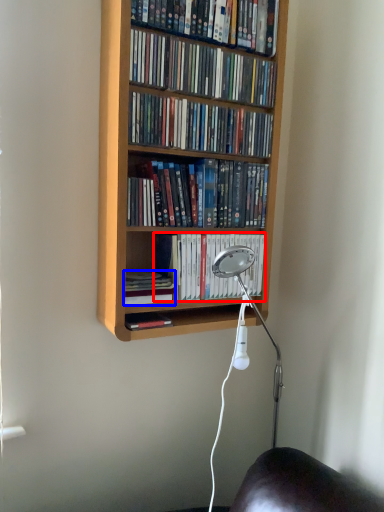
Question: Which object appears farthest to the camera in this image, book (highlighted by a red box) or book (highlighted by a blue box)?

Choices:
 (A) book
 (B) book

Answer: (A)